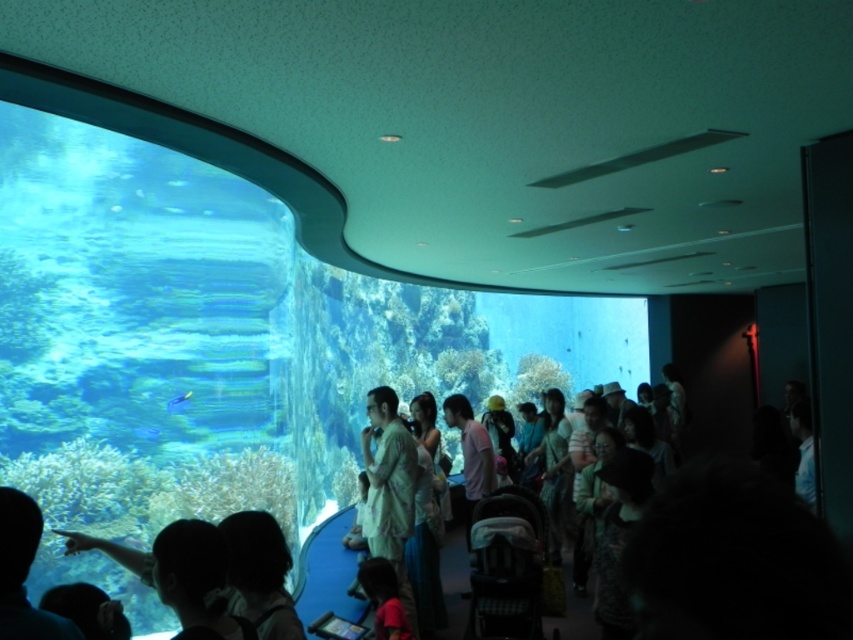
You are a tour guide leading a group near the aquarium. You notice a tourist wearing a matte red shirt at lower center wants to take a photo of the blue glossy fish at center. Can they take a clear photo without moving closer than 6 feet?

The distance between the matte red shirt at lower center and the blue glossy fish at center is 6.55 feet, which is more than 6 feet. Therefore, the tourist can take a clear photo without moving closer than 6 feet.

You are standing in front of the aquarium and notice two blue glossy fish. One is labeled as the blue glossy fish at lower center and the other is the blue glossy fish at center. From your perspective, which fish is positioned to the right of the other?

The blue glossy fish at lower center is to the right of the blue glossy fish at center.